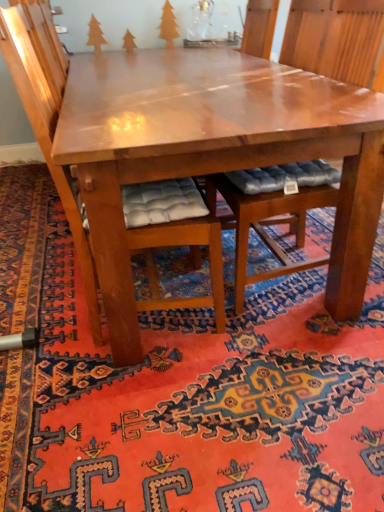
Where is `free space in front of wooden cushioned chair at center, which appears as the 2th chair when viewed from the left`? free space in front of wooden cushioned chair at center, which appears as the 2th chair when viewed from the left is located at coordinates (283, 351).